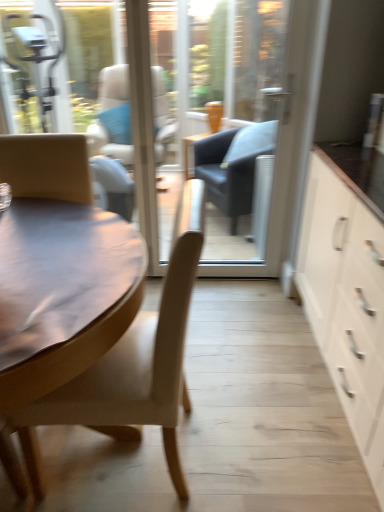
What do you see at coordinates (133, 366) in the screenshot? I see `matte brown chair at left` at bounding box center [133, 366].

You are a GUI agent. You are given a task and a screenshot of the screen. Output one action in this format:
    pyautogui.click(x=<x>, y=<y>)
    Task: Click on the matte brown chair at left
    
    Given the screenshot: What is the action you would take?
    pyautogui.click(x=133, y=366)

Locate an element on the screen. matte brown chair at left is located at coordinates (133, 366).

Is transparent glass door at center aimed at white matte cabinet at right?

Yes, transparent glass door at center is oriented towards white matte cabinet at right.

Which is correct: transparent glass door at center is inside white matte cabinet at right, or outside of it?

transparent glass door at center lies outside white matte cabinet at right.

Looking at this image, from the image's perspective, is transparent glass door at center located above white matte cabinet at right?

Correct, transparent glass door at center appears higher than white matte cabinet at right in the image.

From a real-world perspective, is transparent glass door at center above or below white matte cabinet at right?

From a real-world perspective, transparent glass door at center is physically above white matte cabinet at right.

Considering the relative sizes of white matte cabinet at right and transparent glass door at center in the image provided, is white matte cabinet at right wider than transparent glass door at center?

Yes, white matte cabinet at right is wider than transparent glass door at center.

Identify the location of window screen that appears above the white matte cabinet at right (from the image's perspective). The image size is (384, 512). (203, 117).

How many degrees apart are the facing directions of white matte cabinet at right and transparent glass door at center?

The facing directions of white matte cabinet at right and transparent glass door at center are 89 degrees apart.

Is point (367, 289) in front of point (262, 105)?

Yes, point (367, 289) is closer to viewer.

Is transparent glass door at center inside matte brown chair at left?

Actually, transparent glass door at center is outside matte brown chair at left.

Could you tell me if matte brown chair at left is turned towards transparent glass door at center?

No, matte brown chair at left is not facing towards transparent glass door at center.

How many degrees apart are the facing directions of matte brown chair at left and transparent glass door at center?

88.2 degrees separate the facing orientations of matte brown chair at left and transparent glass door at center.

From a real-world perspective, is matte brown chair at left above or below transparent glass door at center?

In terms of real-world spatial position, matte brown chair at left is below transparent glass door at center.

Is matte brown chair at left completely or partially inside transparent glass door at center?

No, matte brown chair at left is not inside transparent glass door at center.

Where is `chair located underneath the transparent glass door at center (from a real-world perspective)`? The image size is (384, 512). chair located underneath the transparent glass door at center (from a real-world perspective) is located at coordinates (133, 366).

In the image, is transparent glass door at center on the left side or the right side of matte brown chair at left?

In the image, transparent glass door at center appears on the right side of matte brown chair at left.

Based on the photo, from the image's perspective, is transparent glass door at center positioned above or below matte brown chair at left?

Clearly, from the image's perspective, transparent glass door at center is above matte brown chair at left.

Can you tell me how much matte brown chair at left and white matte cabinet at right differ in facing direction?

They differ by 0.822 degrees in their facing directions.

Does matte brown chair at left have a larger size compared to white matte cabinet at right?

No, matte brown chair at left is not bigger than white matte cabinet at right.

Which object is closer to the camera, matte brown chair at left or white matte cabinet at right?

white matte cabinet at right.

In the image, is matte brown chair at left on the left side or the right side of white matte cabinet at right?

matte brown chair at left is positioned on white matte cabinet at right's left side.

Consider the image. Who is more distant, white matte cabinet at right or matte brown chair at left?

matte brown chair at left.

Considering the positions of point (360, 286) and point (133, 339), is point (360, 286) closer or farther from the camera than point (133, 339)?

Point (360, 286).

Is white matte cabinet at right located outside matte brown chair at left?

That's correct, white matte cabinet at right is outside of matte brown chair at left.

You are a GUI agent. You are given a task and a screenshot of the screen. Output one action in this format:
    pyautogui.click(x=<x>, y=<y>)
    Task: Click on the window screen behind the white matte cabinet at right
    
    Given the screenshot: What is the action you would take?
    pyautogui.click(x=203, y=117)

Locate an element on the screen. The image size is (384, 512). cabinetry that appears on the right of transparent glass door at center is located at coordinates (346, 300).

Based on their spatial positions, is matte brown chair at left or transparent glass door at center closer to white matte cabinet at right?

matte brown chair at left is positioned closer to the anchor white matte cabinet at right.

Based on their spatial positions, is matte brown chair at left or white matte cabinet at right further from transparent glass door at center?

matte brown chair at left.

From the image, which object appears to be farther from white matte cabinet at right, transparent glass door at center or matte brown chair at left?

transparent glass door at center is positioned further to the anchor white matte cabinet at right.

In the scene shown: Based on their spatial positions, is white matte cabinet at right or transparent glass door at center further from matte brown chair at left?

transparent glass door at center is positioned further to the anchor matte brown chair at left.

Which object lies further to the anchor point matte brown chair at left, transparent glass door at center or white matte cabinet at right?

transparent glass door at center is further to matte brown chair at left.

From the image, which object appears to be farther from transparent glass door at center, white matte cabinet at right or matte brown chair at left?

matte brown chair at left.

Where is `chair located between white matte cabinet at right and transparent glass door at center in the depth direction`? The image size is (384, 512). chair located between white matte cabinet at right and transparent glass door at center in the depth direction is located at coordinates (133, 366).